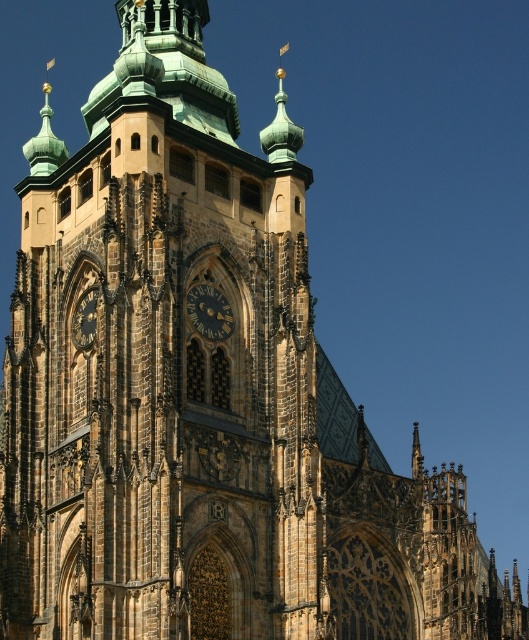
Which of these two, dark brown stone clock at center or gold metallic clock at center, stands taller?

gold metallic clock at center is taller.

Does point (207, 307) lie in front of point (94, 337)?

No, (207, 307) is behind (94, 337).

This screenshot has height=640, width=529. Identify the location of dark brown stone clock at center. pos(209,310).